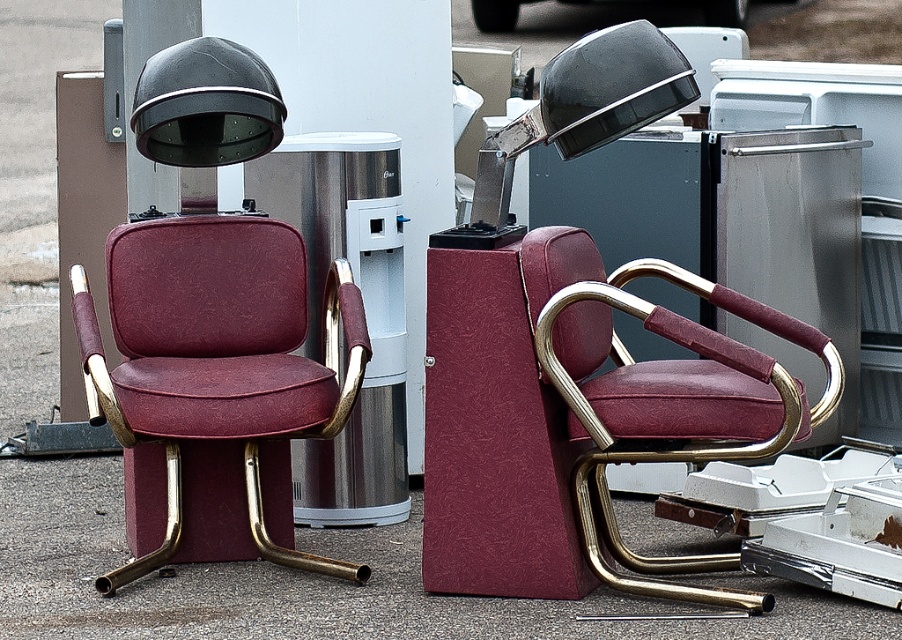
Between maroon leather swivel chair at left and maroon leather swivel chair at center, which one is positioned higher?

maroon leather swivel chair at left is above.

Which is behind, point (183, 276) or point (578, 378)?

The point (183, 276) is behind.

Find the location of a particular element. maroon leather swivel chair at left is located at coordinates point(217,356).

I want to click on maroon leather swivel chair at left, so click(217, 356).

Where is `maroon leather swivel chair at center`? Image resolution: width=902 pixels, height=640 pixels. maroon leather swivel chair at center is located at coordinates (670, 403).

Can you confirm if maroon leather swivel chair at center is thinner than black glossy hairdryer at upper center?

No, maroon leather swivel chair at center is not thinner than black glossy hairdryer at upper center.

Does point (683, 460) lie behind point (256, 136)?

No.

This screenshot has height=640, width=902. I want to click on maroon leather swivel chair at center, so click(670, 403).

Based on the photo, who is more forward, (159,336) or (207,132)?

Point (207,132) is in front.

Is point (254, 486) positioned behind point (185, 54)?

Yes, point (254, 486) is behind point (185, 54).

Is point (329, 397) positioned in front of point (237, 154)?

Yes.

Identify the location of maroon leather swivel chair at left. Image resolution: width=902 pixels, height=640 pixels. (217, 356).